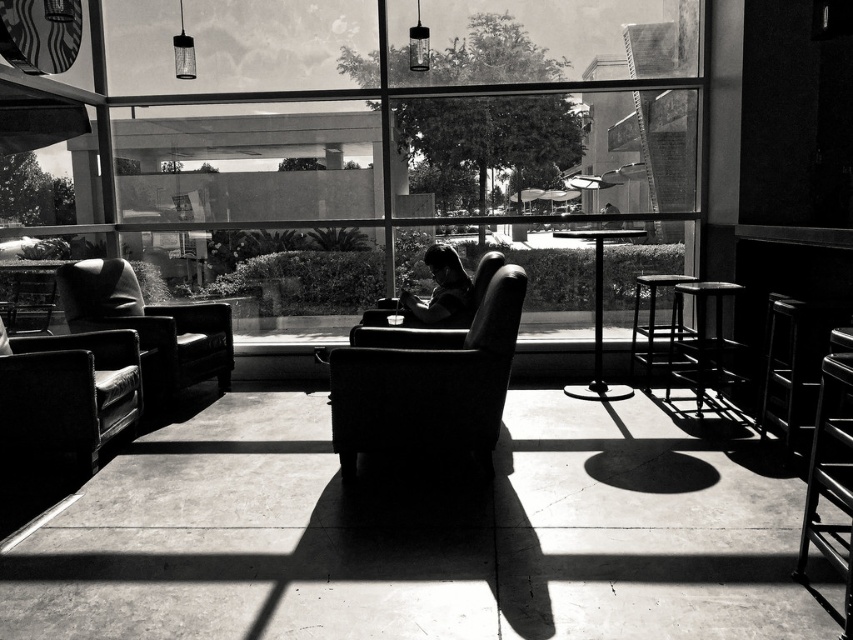
Who is taller, smooth leather armchair at center or smooth black stool at right?

smooth leather armchair at center

Between smooth leather armchair at center and smooth black stool at right, which one has less height?

With less height is smooth black stool at right.

Who is more forward, (341,356) or (769,317)?

Point (341,356)

Identify the location of smooth leather armchair at center. The image size is (853, 640). coord(428,385).

Is transparent glass window at center shorter than smooth black stool at right?

In fact, transparent glass window at center may be taller than smooth black stool at right.

Does transparent glass window at center have a greater width compared to smooth black stool at right?

Yes, transparent glass window at center is wider than smooth black stool at right.

The image size is (853, 640). What are the coordinates of `transparent glass window at center` in the screenshot? It's located at (360, 147).

Is smooth skin person at center to the left of black metal stool at right from the viewer's perspective?

Correct, you'll find smooth skin person at center to the left of black metal stool at right.

Can you confirm if smooth skin person at center is taller than black metal stool at right?

No.

Which is behind, point (463, 282) or point (653, 285)?

The point (653, 285) is behind.

The width and height of the screenshot is (853, 640). I want to click on smooth skin person at center, so click(x=440, y=292).